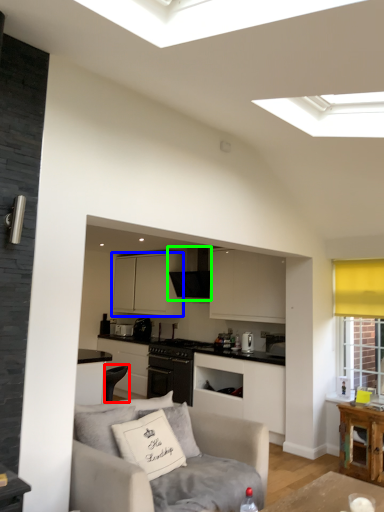
Question: Based on their relative distances, which object is nearer to armchair (highlighted by a red box)? Choose from cabinetry (highlighted by a blue box) and exhaust hood (highlighted by a green box).

Choices:
 (A) cabinetry
 (B) exhaust hood

Answer: (B)